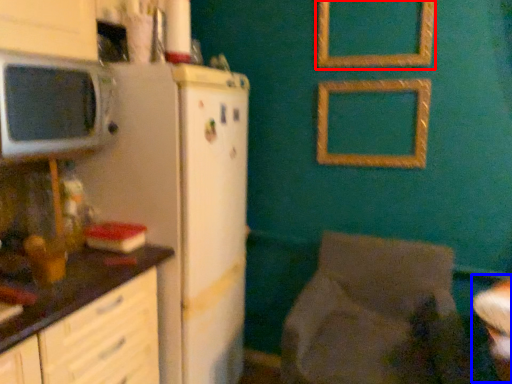
Question: Which of the following is the farthest to the observer, picture frame (highlighted by a red box) or table (highlighted by a blue box)?

Choices:
 (A) picture frame
 (B) table

Answer: (A)